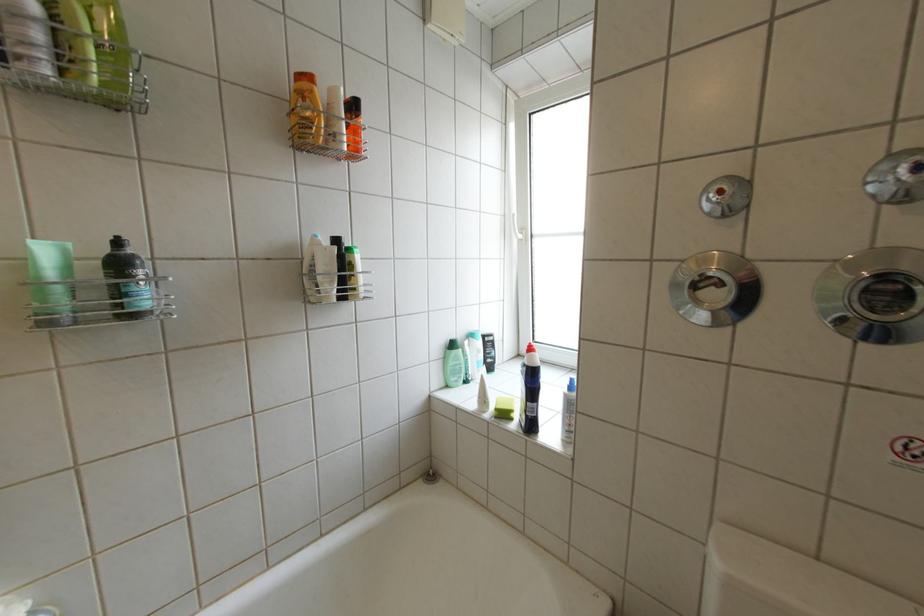
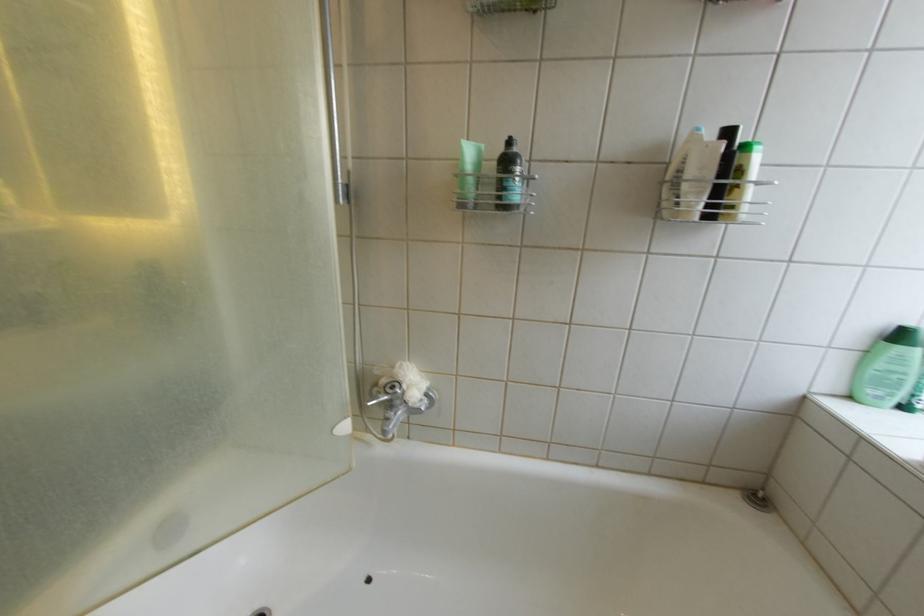
Question: The camera is either moving clockwise (left) or counter-clockwise (right) around the object. The first image is from the beginning of the video and the second image is from the end. Is the camera moving left or right when shooting the video?

Choices:
 (A) Left
 (B) Right

Answer: (B)